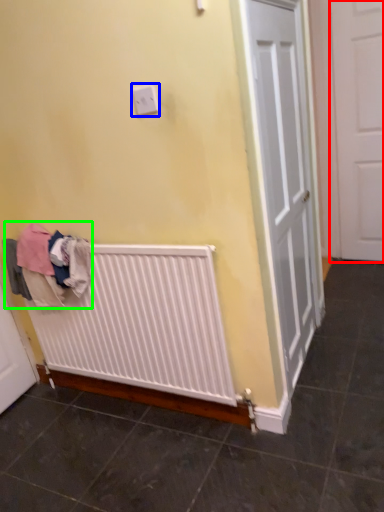
Question: Which is nearer to the door (highlighted by a red box)? electric outlet (highlighted by a blue box) or clothing (highlighted by a green box).

Choices:
 (A) electric outlet
 (B) clothing

Answer: (A)